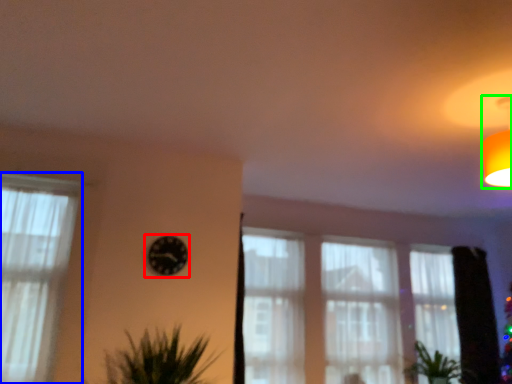
Question: Estimate the real-world distances between objects in this image. Which object is closer to clock (highlighted by a red box), curtain (highlighted by a blue box) or light fixture (highlighted by a green box)?

Choices:
 (A) curtain
 (B) light fixture

Answer: (A)